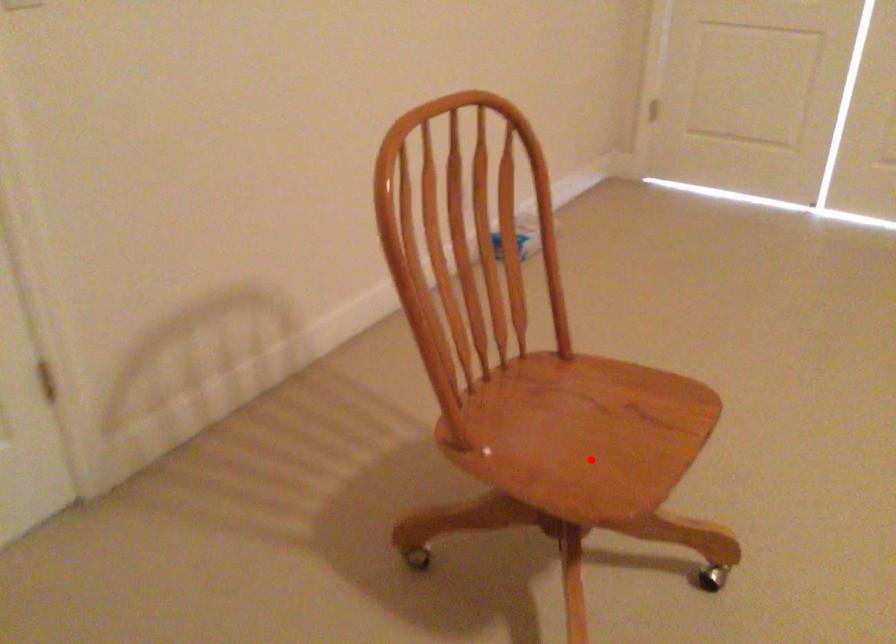
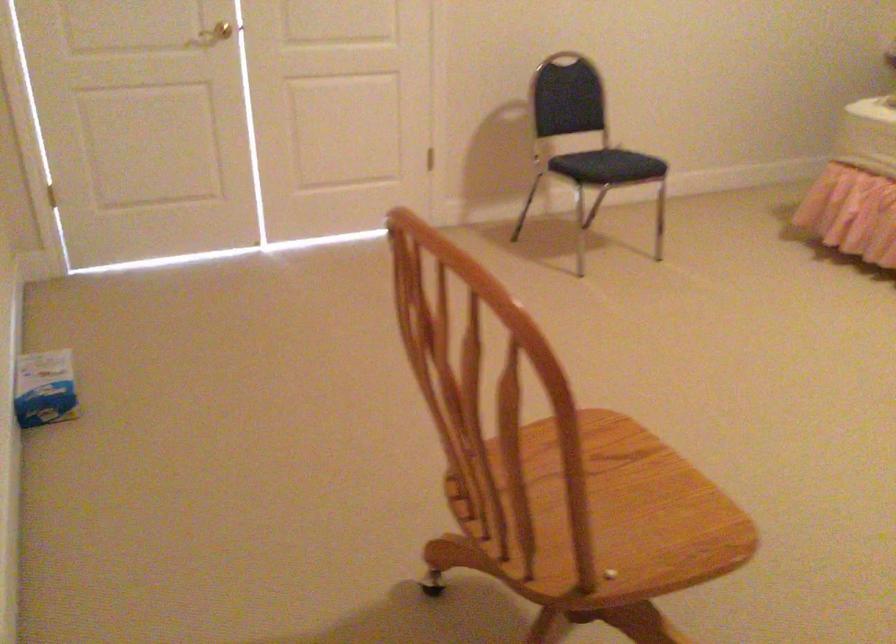
The point at the highlighted location is marked in the first image. Where is the corresponding point in the second image?

(613, 509)